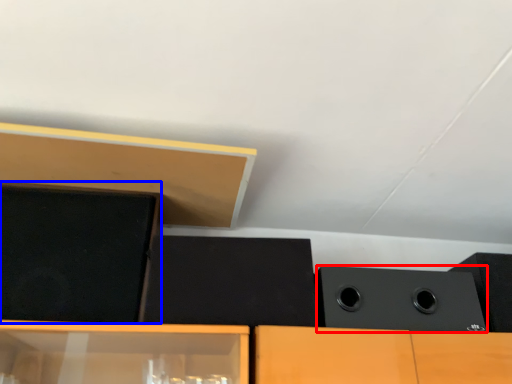
Question: Which point is further to the camera, speaker (highlighted by a red box) or speaker (highlighted by a blue box)?

Choices:
 (A) speaker
 (B) speaker

Answer: (A)